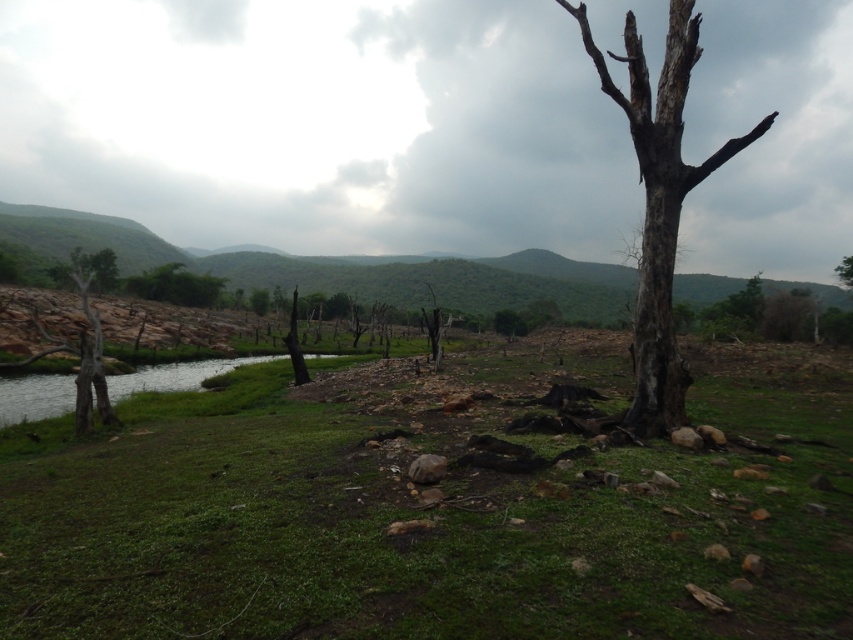
Question: In this image, where is dark gray bark tree at right located relative to green leafy bush at left?

Choices:
 (A) left
 (B) right

Answer: (B)

Question: From the image, what is the correct spatial relationship of green leafy bush at left in relation to brown rough tree at right?

Choices:
 (A) above
 (B) below

Answer: (B)

Question: Among these objects, which one is nearest to the camera?

Choices:
 (A) green leafy bush at left
 (B) dark gray bark tree at right
 (C) brown rough tree at center

Answer: (B)

Question: Which object appears farthest from the camera in this image?

Choices:
 (A) green leafy bush at left
 (B) dark gray bark tree at right
 (C) brown rough tree at center

Answer: (C)

Question: Which point is closer to the camera?

Choices:
 (A) (32, 211)
 (B) (656, 432)

Answer: (B)

Question: Does green grassy at center appear under brown rough tree at center?

Choices:
 (A) yes
 (B) no

Answer: (A)